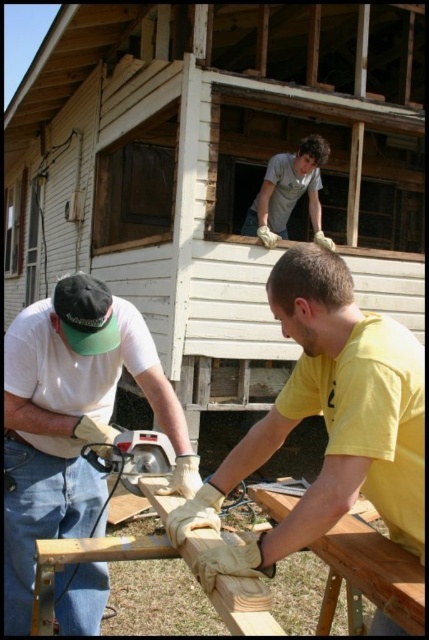
What is the exact location of the yellow matte shirt at lower right in the image?

The yellow matte shirt at lower right is located at point (329, 420).

You are a construction worker standing at the point labeled point (82, 531) and want to move to the point labeled point (374, 481). Which direction should you move in to reach your destination?

You should move forward to reach point (374, 481) from point (82, 531) because the first point is in front of the second point.